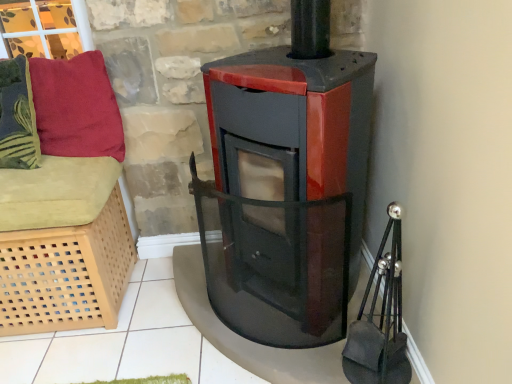
At what (x,y) coordinates should I click in order to perform the action: click on velvety green pillow at left, the 1th pillow when ordered from left to right. Please return your answer as a coordinate pair (x, y). The width and height of the screenshot is (512, 384). Looking at the image, I should click on (17, 117).

Locate an element on the screen. velvety green pillow at left, the 1th pillow when ordered from left to right is located at coordinates (17, 117).

Is there a large distance between velvety red pillow at upper left, the 1th pillow viewed from the right, and velvety green pillow at left, the 2th pillow when ordered from right to left?

That's not correct — velvety red pillow at upper left, the 1th pillow viewed from the right, is a little close to velvety green pillow at left, the 2th pillow when ordered from right to left.

Which is closer to the camera, (x=74, y=66) or (x=31, y=126)?

Point (x=74, y=66) appears to be closer to the viewer than point (x=31, y=126).

Based on their sizes in the image, would you say velvety red pillow at upper left, the 1th pillow viewed from the right, is bigger or smaller than velvety green pillow at left, the 2th pillow when ordered from right to left?

velvety red pillow at upper left, the 1th pillow viewed from the right, is bigger than velvety green pillow at left, the 2th pillow when ordered from right to left.

From a real-world perspective, is velvety red pillow at upper left, which ranks as the second pillow in left-to-right order, physically located above or below velvety green pillow at left, the 2th pillow when ordered from right to left?

From a real-world perspective, velvety red pillow at upper left, which ranks as the second pillow in left-to-right order, is physically below velvety green pillow at left, the 2th pillow when ordered from right to left.

Considering the relative sizes of velvety green pillow at left, the 1th pillow when ordered from left to right, and light wood lattice basket at left in the image provided, is velvety green pillow at left, the 1th pillow when ordered from left to right, bigger than light wood lattice basket at left?

No, velvety green pillow at left, the 1th pillow when ordered from left to right, is not bigger than light wood lattice basket at left.

Locate an element on the screen. Image resolution: width=512 pixels, height=384 pixels. the 1st pillow behind when counting from the light wood lattice basket at left is located at coordinates (17, 117).

What's the angular difference between velvety green pillow at left, the 1th pillow when ordered from left to right, and light wood lattice basket at left's facing directions?

They differ by 0.000735 degrees in their facing directions.

From a real-world perspective, who is located higher, velvety green pillow at left, the 2th pillow when ordered from right to left, or light wood lattice basket at left?

velvety green pillow at left, the 2th pillow when ordered from right to left.

From a real-world perspective, is light wood lattice basket at left beneath velvety red pillow at upper left, the 1th pillow viewed from the right?

Correct, in the physical world, light wood lattice basket at left is lower than velvety red pillow at upper left, the 1th pillow viewed from the right.

Is light wood lattice basket at left oriented away from velvety red pillow at upper left, the 1th pillow viewed from the right?

No, velvety red pillow at upper left, the 1th pillow viewed from the right, is not at the back of light wood lattice basket at left.

Does light wood lattice basket at left have a lesser height compared to velvety red pillow at upper left, which ranks as the second pillow in left-to-right order?

In fact, light wood lattice basket at left may be taller than velvety red pillow at upper left, which ranks as the second pillow in left-to-right order.

Looking at this image, from the image's perspective, which one is positioned lower, light wood lattice basket at left or velvety red pillow at upper left, the 1th pillow viewed from the right?

light wood lattice basket at left, from the image's perspective.

Could you tell me if light wood lattice basket at left is facing velvety green pillow at left, the 2th pillow when ordered from right to left?

No, light wood lattice basket at left is not turned towards velvety green pillow at left, the 2th pillow when ordered from right to left.

In the scene shown: Is light wood lattice basket at left inside or outside of velvety green pillow at left, the 1th pillow when ordered from left to right?

light wood lattice basket at left lies outside velvety green pillow at left, the 1th pillow when ordered from left to right.

Identify the location of pillow to the left of light wood lattice basket at left. (17, 117).

Which of these two, light wood lattice basket at left or velvety green pillow at left, the 2th pillow when ordered from right to left, stands shorter?

velvety green pillow at left, the 2th pillow when ordered from right to left, is shorter.

Is velvety green pillow at left, the 1th pillow when ordered from left to right, next to velvety red pillow at upper left, which ranks as the second pillow in left-to-right order, and touching it?

velvety green pillow at left, the 1th pillow when ordered from left to right, is not next to velvety red pillow at upper left, which ranks as the second pillow in left-to-right order, and they're not touching.

Could you tell me if velvety green pillow at left, the 1th pillow when ordered from left to right, is turned towards velvety red pillow at upper left, the 1th pillow viewed from the right?

No, velvety green pillow at left, the 1th pillow when ordered from left to right, is not oriented towards velvety red pillow at upper left, the 1th pillow viewed from the right.

Is point (35, 147) less distant than point (34, 94)?

No, it is not.

From a real-world perspective, is velvety green pillow at left, the 1th pillow when ordered from left to right, below velvety red pillow at upper left, the 1th pillow viewed from the right?

Actually, velvety green pillow at left, the 1th pillow when ordered from left to right, is physically above velvety red pillow at upper left, the 1th pillow viewed from the right, in the real world.

From the image's perspective, is velvety red pillow at upper left, which ranks as the second pillow in left-to-right order, located beneath light wood lattice basket at left?

No.

From the image's perspective, starting from the light wood lattice basket at left, which pillow is the 2nd one above? Please provide its 2D coordinates.

[(76, 107)]

Is velvety red pillow at upper left, the 1th pillow viewed from the right, positioned behind light wood lattice basket at left?

Yes.

Locate an element on the screen. pillow below the velvety green pillow at left, the 1th pillow when ordered from left to right (from a real-world perspective) is located at coordinates (76, 107).

The width and height of the screenshot is (512, 384). I want to click on furniture in front of the velvety green pillow at left, the 2th pillow when ordered from right to left, so click(66, 207).

When comparing their distances from velvety green pillow at left, the 1th pillow when ordered from left to right, does velvety red pillow at upper left, which ranks as the second pillow in left-to-right order, or light wood lattice basket at left seem closer?

Among the two, velvety red pillow at upper left, which ranks as the second pillow in left-to-right order, is located nearer to velvety green pillow at left, the 1th pillow when ordered from left to right.

Looking at the image, which one is located further to light wood lattice basket at left, velvety green pillow at left, the 2th pillow when ordered from right to left, or velvety red pillow at upper left, the 1th pillow viewed from the right?

Based on the image, velvety green pillow at left, the 2th pillow when ordered from right to left, appears to be further to light wood lattice basket at left.

From the image, which object appears to be nearer to light wood lattice basket at left, velvety red pillow at upper left, the 1th pillow viewed from the right, or velvety green pillow at left, the 2th pillow when ordered from right to left?

The object closer to light wood lattice basket at left is velvety red pillow at upper left, the 1th pillow viewed from the right.

Based on their spatial positions, is light wood lattice basket at left or velvety green pillow at left, the 2th pillow when ordered from right to left, further from velvety red pillow at upper left, the 1th pillow viewed from the right?

light wood lattice basket at left is further to velvety red pillow at upper left, the 1th pillow viewed from the right.

From the image, which object appears to be nearer to velvety red pillow at upper left, the 1th pillow viewed from the right, velvety green pillow at left, the 1th pillow when ordered from left to right, or light wood lattice basket at left?

The object closer to velvety red pillow at upper left, the 1th pillow viewed from the right, is velvety green pillow at left, the 1th pillow when ordered from left to right.

Considering their positions, is light wood lattice basket at left positioned closer to velvety green pillow at left, the 2th pillow when ordered from right to left, than velvety red pillow at upper left, the 1th pillow viewed from the right?

Based on the image, velvety red pillow at upper left, the 1th pillow viewed from the right, appears to be nearer to velvety green pillow at left, the 2th pillow when ordered from right to left.

Locate an element on the screen. The height and width of the screenshot is (384, 512). pillow between velvety red pillow at upper left, the 1th pillow viewed from the right, and light wood lattice basket at left from top to bottom is located at coordinates (17, 117).